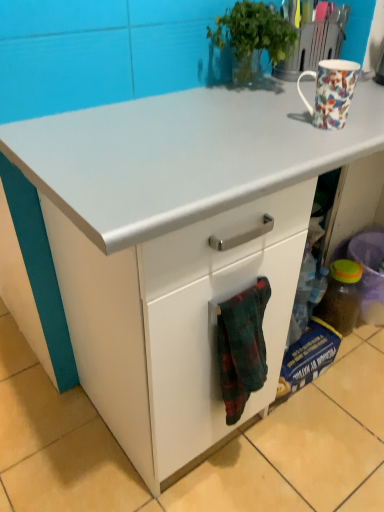
Measure the distance between point (342,327) and camera.

The distance of point (342,327) from camera is 1.53 meters.

Describe the element at coordinates (331, 92) in the screenshot. I see `floral porcelain mug at upper right` at that location.

Describe the element at coordinates (253, 37) in the screenshot. I see `green leafy plant at upper center` at that location.

Find the location of `flannel fabric towel at lower center`. flannel fabric towel at lower center is located at coordinates (242, 347).

Image resolution: width=384 pixels, height=512 pixels. Find the location of `translucent plastic bottle at lower right`. translucent plastic bottle at lower right is located at coordinates (341, 296).

Which object is further away from the camera taking this photo, translucent plastic bottle at lower right or floral porcelain mug at upper right?

translucent plastic bottle at lower right.

Between translucent plastic bottle at lower right and floral porcelain mug at upper right, which one appears on the right side from the viewer's perspective?

From the viewer's perspective, translucent plastic bottle at lower right appears more on the right side.

Does point (351, 263) come farther from viewer compared to point (338, 118)?

Yes.

From the picture: Is translucent plastic bottle at lower right aimed at floral porcelain mug at upper right?

No, translucent plastic bottle at lower right is not turned towards floral porcelain mug at upper right.

Is green leafy plant at upper center positioned with its back to flannel fabric towel at lower center?

No, green leafy plant at upper center is not facing the opposite direction of flannel fabric towel at lower center.

Who is shorter, green leafy plant at upper center or flannel fabric towel at lower center?

green leafy plant at upper center is shorter.

Which is in front, green leafy plant at upper center or flannel fabric towel at lower center?

flannel fabric towel at lower center.

Are floral porcelain mug at upper right and translucent plastic bottle at lower right far apart?

No, floral porcelain mug at upper right is not far from translucent plastic bottle at lower right.

Could you measure the distance between floral porcelain mug at upper right and translucent plastic bottle at lower right?

The distance of floral porcelain mug at upper right from translucent plastic bottle at lower right is 76.81 centimeters.

Between floral porcelain mug at upper right and translucent plastic bottle at lower right, which one has smaller size?

With smaller size is floral porcelain mug at upper right.

Consider the image. From a real-world perspective, is floral porcelain mug at upper right positioned over translucent plastic bottle at lower right based on gravity?

Yes.

From the image's perspective, which is above, translucent plastic bottle at lower right or flannel fabric towel at lower center?

translucent plastic bottle at lower right appears higher in the image.

I want to click on blanket above the translucent plastic bottle at lower right (from a real-world perspective), so click(242, 347).

Looking at this image, how much distance is there between translucent plastic bottle at lower right and flannel fabric towel at lower center?

translucent plastic bottle at lower right and flannel fabric towel at lower center are 26.75 inches apart.

Based on the photo, which is more to the right, translucent plastic bottle at lower right or flannel fabric towel at lower center?

Positioned to the right is translucent plastic bottle at lower right.

Looking at this image, is flannel fabric towel at lower center facing towards floral porcelain mug at upper right?

No, flannel fabric towel at lower center is not oriented towards floral porcelain mug at upper right.

How different are the orientations of flannel fabric towel at lower center and floral porcelain mug at upper right in degrees?

flannel fabric towel at lower center and floral porcelain mug at upper right are facing 6.03 degrees away from each other.

Which of these two, flannel fabric towel at lower center or floral porcelain mug at upper right, is smaller?

floral porcelain mug at upper right.

From the image's perspective, between flannel fabric towel at lower center and floral porcelain mug at upper right, which one is located above?

floral porcelain mug at upper right is shown above in the image.

Based on the photo, which is more to the right, floral porcelain mug at upper right or green leafy plant at upper center?

From the viewer's perspective, floral porcelain mug at upper right appears more on the right side.

How different are the orientations of floral porcelain mug at upper right and green leafy plant at upper center in degrees?

The angle between the facing direction of floral porcelain mug at upper right and the facing direction of green leafy plant at upper center is 8.55 degrees.

In the scene shown: Between floral porcelain mug at upper right and green leafy plant at upper center, which one has larger size?

Bigger between the two is green leafy plant at upper center.

Which point is more forward, (335, 81) or (269, 42)?

The point (335, 81) is closer to the camera.

Is green leafy plant at upper center completely or partially inside translucent plastic bottle at lower right?

No, green leafy plant at upper center is not surrounded by translucent plastic bottle at lower right.

Is point (325, 298) more distant than point (226, 26)?

Yes, it is behind point (226, 26).

From a real-world perspective, which is physically above, translucent plastic bottle at lower right or green leafy plant at upper center?

From a 3D spatial view, green leafy plant at upper center is above.

Looking at this image, which is more to the right, translucent plastic bottle at lower right or green leafy plant at upper center?

translucent plastic bottle at lower right is more to the right.

Where is `bottle on the right of the floral porcelain mug at upper right`? The image size is (384, 512). bottle on the right of the floral porcelain mug at upper right is located at coordinates (341, 296).

You are a GUI agent. You are given a task and a screenshot of the screen. Output one action in this format:
    pyautogui.click(x=<x>, y=<y>)
    Task: Click on the houseplant above the flannel fabric towel at lower center (from the image's perspective)
    
    Given the screenshot: What is the action you would take?
    pyautogui.click(x=253, y=37)

Based on their spatial positions, is floral porcelain mug at upper right or translucent plastic bottle at lower right further from green leafy plant at upper center?

Among the two, translucent plastic bottle at lower right is located further to green leafy plant at upper center.

Based on their spatial positions, is green leafy plant at upper center or translucent plastic bottle at lower right further from flannel fabric towel at lower center?

translucent plastic bottle at lower right is positioned further to the anchor flannel fabric towel at lower center.

Looking at the image, which one is located further to floral porcelain mug at upper right, flannel fabric towel at lower center or translucent plastic bottle at lower right?

Among the two, translucent plastic bottle at lower right is located further to floral porcelain mug at upper right.

Which object lies further to the anchor point green leafy plant at upper center, translucent plastic bottle at lower right or flannel fabric towel at lower center?

translucent plastic bottle at lower right is positioned further to the anchor green leafy plant at upper center.

Which object lies further to the anchor point flannel fabric towel at lower center, floral porcelain mug at upper right or translucent plastic bottle at lower right?

Based on the image, translucent plastic bottle at lower right appears to be further to flannel fabric towel at lower center.

Which object lies nearer to the anchor point green leafy plant at upper center, translucent plastic bottle at lower right or floral porcelain mug at upper right?

Based on the image, floral porcelain mug at upper right appears to be nearer to green leafy plant at upper center.

From the image, which object appears to be farther from translucent plastic bottle at lower right, floral porcelain mug at upper right or green leafy plant at upper center?

Among the two, green leafy plant at upper center is located further to translucent plastic bottle at lower right.

Which object lies nearer to the anchor point floral porcelain mug at upper right, translucent plastic bottle at lower right or flannel fabric towel at lower center?

flannel fabric towel at lower center.

At what (x,y) coordinates should I click in order to perform the action: click on bottle between green leafy plant at upper center and flannel fabric towel at lower center in the up-down direction. Please return your answer as a coordinate pair (x, y). The image size is (384, 512). Looking at the image, I should click on (341, 296).

You are a GUI agent. You are given a task and a screenshot of the screen. Output one action in this format:
    pyautogui.click(x=<x>, y=<y>)
    Task: Click on the coffee cup located between flannel fabric towel at lower center and translucent plastic bottle at lower right in the depth direction
    
    Given the screenshot: What is the action you would take?
    [x=331, y=92]

This screenshot has width=384, height=512. I want to click on coffee cup between green leafy plant at upper center and translucent plastic bottle at lower right in the vertical direction, so click(x=331, y=92).

This screenshot has width=384, height=512. Find the location of `coffee cup between green leafy plant at upper center and flannel fabric towel at lower center from top to bottom`. coffee cup between green leafy plant at upper center and flannel fabric towel at lower center from top to bottom is located at coordinates (331, 92).